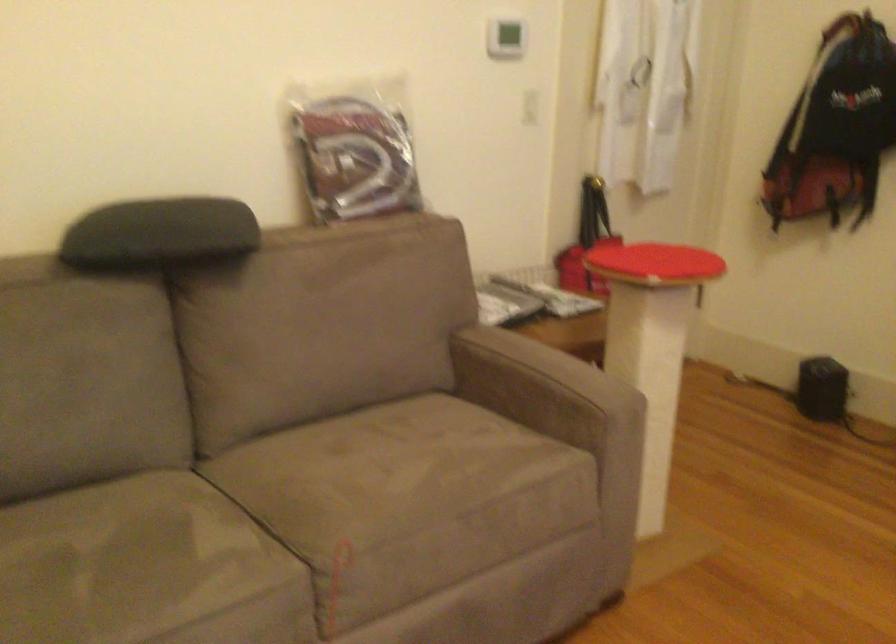
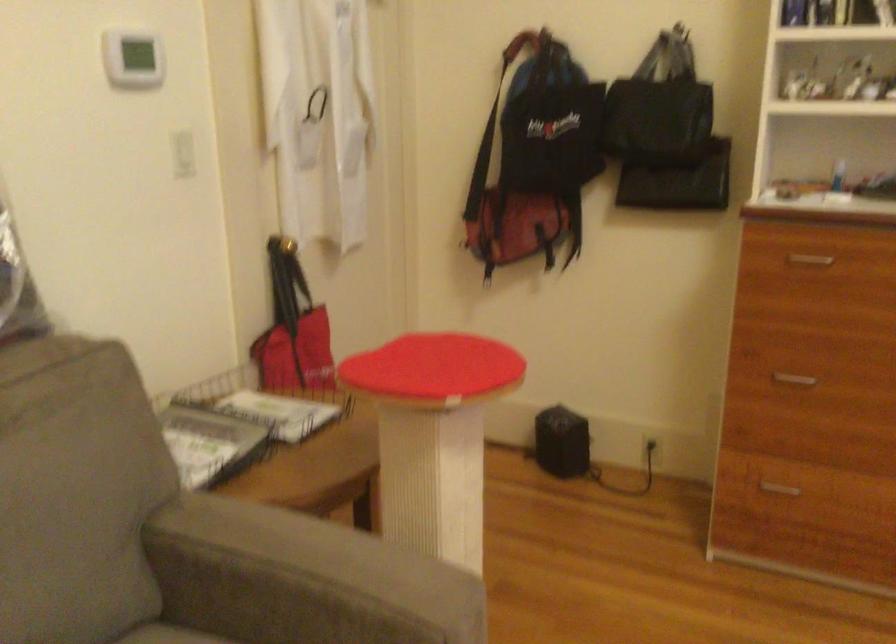
Question: What movement of the cameraman would produce the second image?

Choices:
 (A) Left
 (B) Right
 (C) Forward
 (D) Backward

Answer: (C)